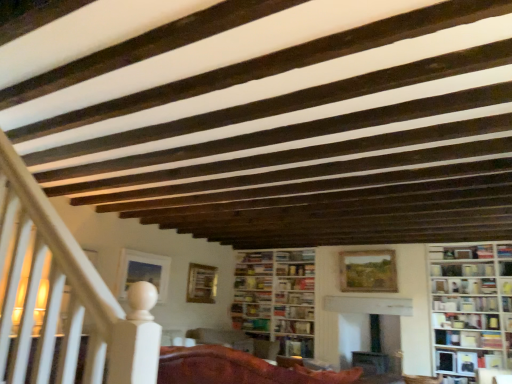
Question: Is wooden bookshelf at lower right completely or partially inside hardcover book at center, placed as the 6th book when sorted from top to bottom?

Choices:
 (A) no
 (B) yes

Answer: (A)

Question: Does hardcover book at center, positioned as the 1th book in bottom-to-top order, turn towards wooden bookshelf at lower right?

Choices:
 (A) yes
 (B) no

Answer: (B)

Question: Is hardcover book at center, positioned as the 1th book in bottom-to-top order, bigger than wooden bookshelf at lower right?

Choices:
 (A) yes
 (B) no

Answer: (A)

Question: Is hardcover book at center, positioned as the 1th book in bottom-to-top order, not near wooden bookshelf at lower right?

Choices:
 (A) yes
 (B) no

Answer: (A)

Question: From a real-world perspective, is hardcover book at center, placed as the 6th book when sorted from top to bottom, on top of wooden bookshelf at lower right?

Choices:
 (A) yes
 (B) no

Answer: (B)

Question: Is point click(x=434, y=266) closer or farther from the camera than point click(x=309, y=281)?

Choices:
 (A) closer
 (B) farther

Answer: (A)

Question: Is hardcover book at center, which is the 1th book in top-to-bottom order, in front of or behind hardcover book at center, which ranks as the 3th book in top-to-bottom order, in the image?

Choices:
 (A) behind
 (B) front

Answer: (B)

Question: In the image, is hardcover book at center, placed as the sixth book when sorted from bottom to top, on the left side or the right side of hardcover book at center, which ranks as the 3th book in top-to-bottom order?

Choices:
 (A) right
 (B) left

Answer: (A)

Question: From the image's perspective, is hardcover book at center, placed as the sixth book when sorted from bottom to top, above or below hardcover book at center, the fourth book from the bottom?

Choices:
 (A) above
 (B) below

Answer: (A)

Question: Considering the relative positions of hardcover book at center, placed as the 6th book when sorted from top to bottom, and wooden bookshelf at lower right in the image provided, is hardcover book at center, placed as the 6th book when sorted from top to bottom, to the left or to the right of wooden bookshelf at lower right?

Choices:
 (A) right
 (B) left

Answer: (B)

Question: Relative to wooden bookshelf at lower right, is hardcover book at center, positioned as the 1th book in bottom-to-top order, in front or behind?

Choices:
 (A) front
 (B) behind

Answer: (B)

Question: Considering the positions of hardcover book at center, placed as the 6th book when sorted from top to bottom, and wooden bookshelf at lower right in the image, is hardcover book at center, placed as the 6th book when sorted from top to bottom, taller or shorter than wooden bookshelf at lower right?

Choices:
 (A) tall
 (B) short

Answer: (A)

Question: Is point (305, 350) positioned closer to the camera than point (501, 365)?

Choices:
 (A) closer
 (B) farther

Answer: (B)

Question: Looking at their shapes, would you say hardcover book at center, positioned as the 2th book in bottom-to-top order, is wider or thinner than hardcover book at center, which ranks as the 3th book in top-to-bottom order?

Choices:
 (A) thin
 (B) wide

Answer: (B)

Question: From a real-world perspective, relative to hardcover book at center, the fourth book from the bottom, is hardcover book at center, positioned as the 2th book in bottom-to-top order, vertically above or below?

Choices:
 (A) above
 (B) below

Answer: (B)